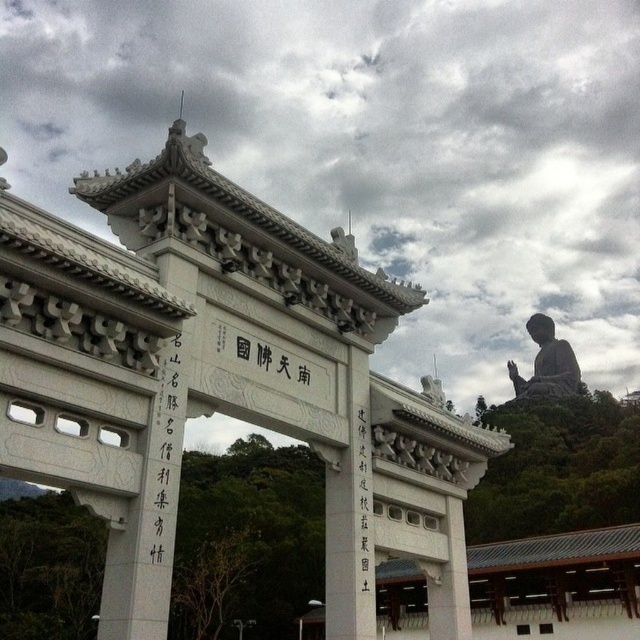
Is white stone gate at center shorter than black stone statue at upper right?

In fact, white stone gate at center may be taller than black stone statue at upper right.

Is point (240, 381) positioned in front of point (564, 380)?

That is True.

Identify the location of white stone gate at center. (221, 381).